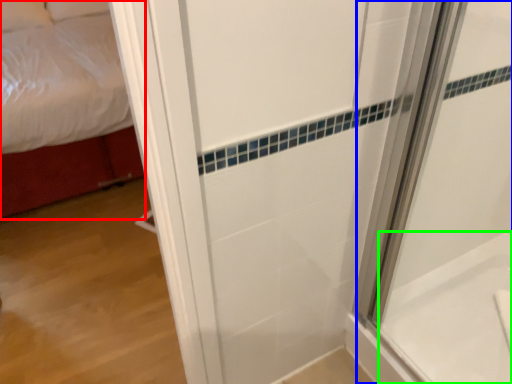
Question: Which is farther away from bed (highlighted by a red box)? shower door (highlighted by a blue box) or bath (highlighted by a green box)?

Choices:
 (A) shower door
 (B) bath

Answer: (B)